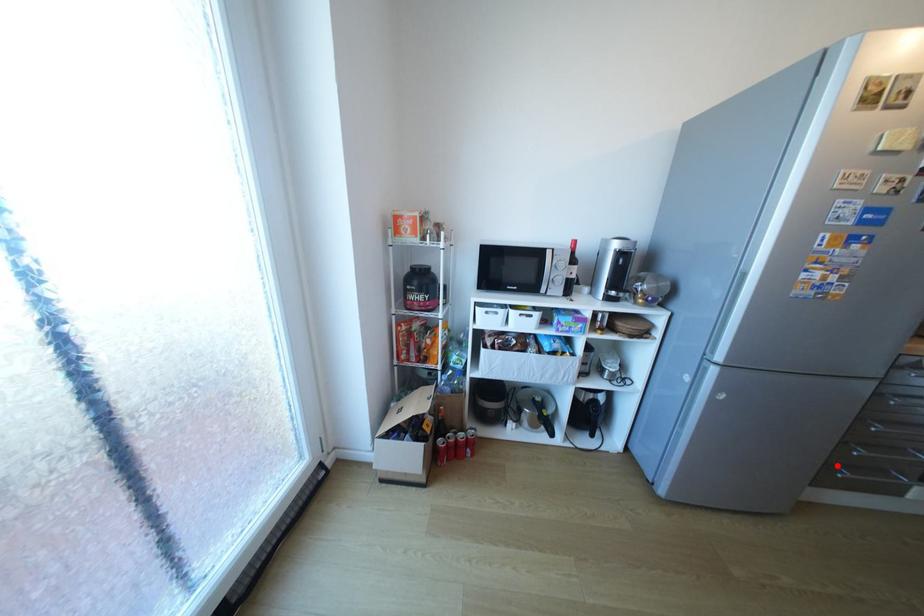
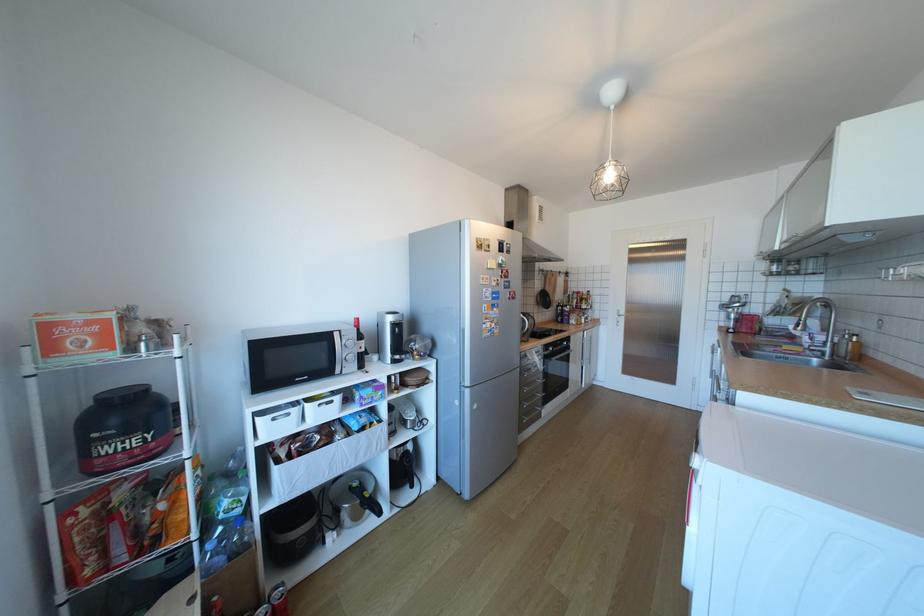
Question: I am providing you with two images of the same scene from different viewpoints. Image1 has a red point marked. In image2, the corresponding 3D location appears at what relative position? Reply with the corresponding letter.

Choices:
 (A) Closer
 (B) Farther

Answer: (B)